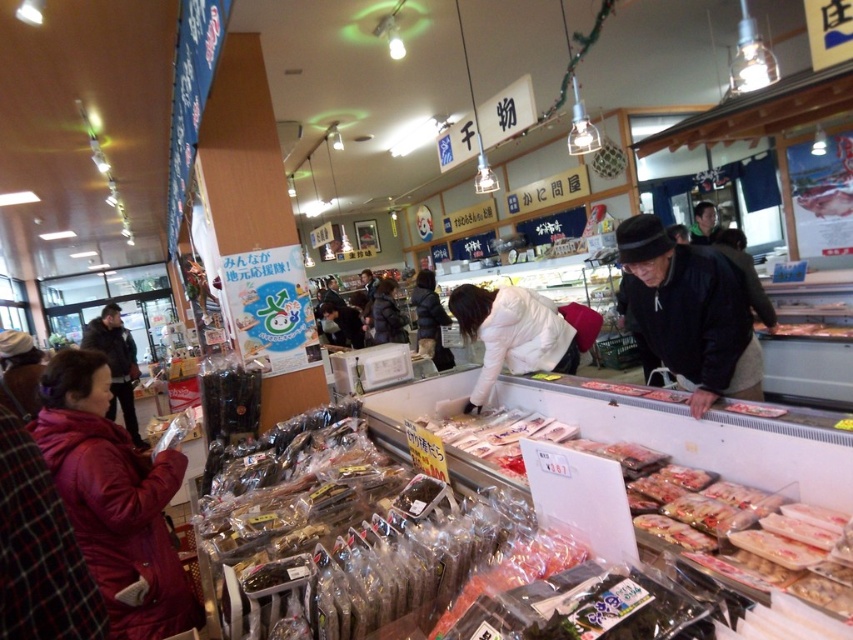
You are a store employee who needs to move a heavy box from the dark brown leather jacket at lower left to the black matte jacket at center. The box is 20 feet long. Can you move it without bending or lifting it? Please explain your reasoning.

The distance between the dark brown leather jacket at lower left and the black matte jacket at center is 19.60 feet. Since the box is 20 feet long, it is slightly longer than the available space. Therefore, you would need to bend or adjust the box to fit within the 19.60 feet distance.

You are a customer in the market and want to pick up both the black matte jacket at center and the dark brown leather jacket at lower left. Which jacket should you pick up first to follow the store policy of picking items from the bottom first?

The dark brown leather jacket at lower left should be picked up first because it is located below the black matte jacket at center, following the store policy of picking items from the bottom first.